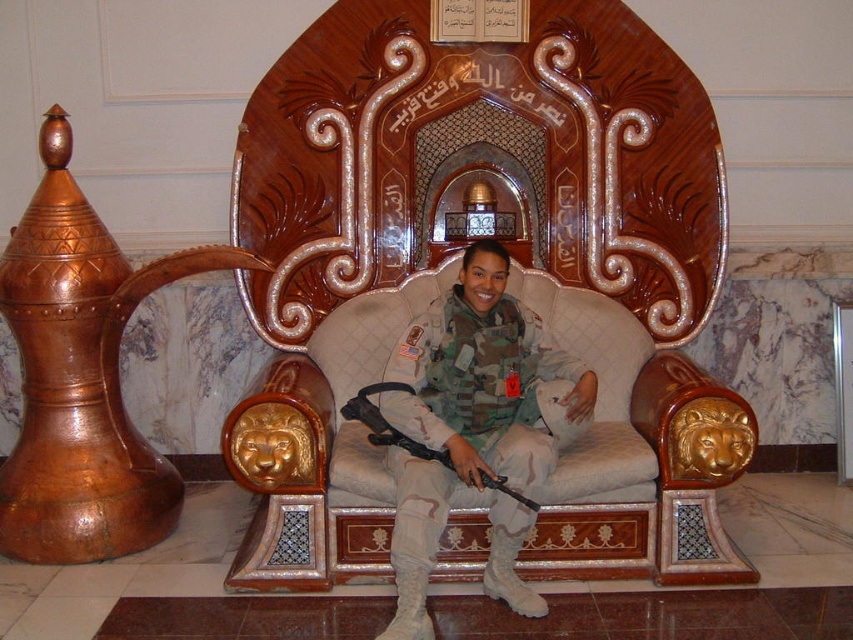
You are standing in front of the throne chair and want to place two items on the chair. The first item is at point [440,560] and the second item is at point [488,516]. Which item should you place first if you want to place them from front to back?

You should place the item at point [488,516] first because it is in front of point [440,560].

You are standing in front of the throne room and see the wooden throne at center and the camouflage uniform at center. Which object is positioned to the right of the other?

The wooden throne at center is to the right of the camouflage uniform at center.